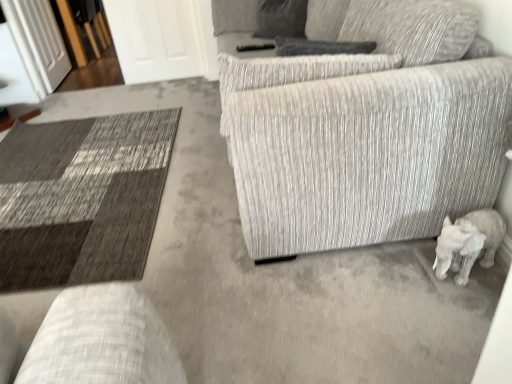
Question: Is textured gray couch at center inside the boundaries of white matte elephant at lower right, or outside?

Choices:
 (A) outside
 (B) inside

Answer: (A)

Question: Does point (426, 203) appear closer or farther from the camera than point (470, 261)?

Choices:
 (A) closer
 (B) farther

Answer: (B)

Question: Based on their relative distances, which object is farther from the white glossy door at upper left, which is counted as the second glass door, starting from the left?

Choices:
 (A) transparent glass door at upper left, placed as the first glass door when sorted from left to right
 (B) white matte elephant at lower right
 (C) textured gray couch at center
 (D) gray fabric pillow at upper center

Answer: (B)

Question: Based on their relative distances, which object is nearer to the gray fabric pillow at upper center?

Choices:
 (A) white matte elephant at lower right
 (B) white glossy door at upper left, acting as the first glass door starting from the right
 (C) transparent glass door at upper left, arranged as the 2th glass door when viewed from the right
 (D) textured gray couch at center

Answer: (B)